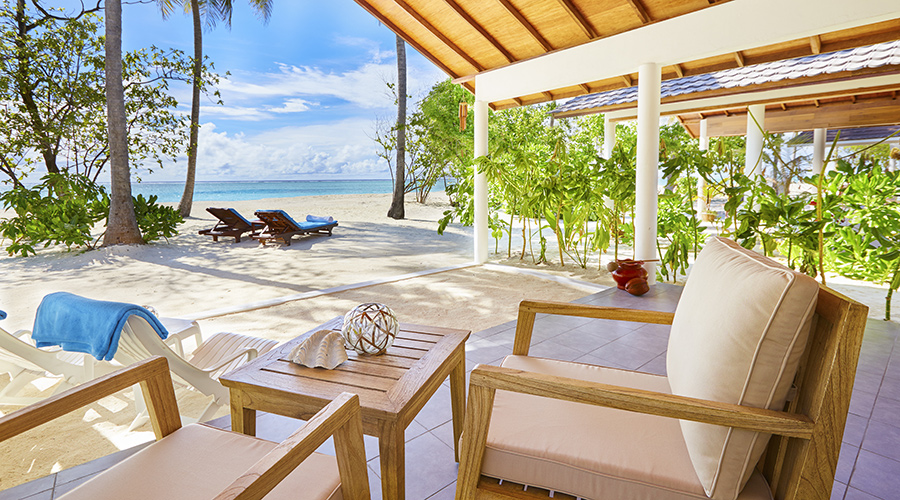
The width and height of the screenshot is (900, 500). I want to click on table, so click(x=379, y=388).